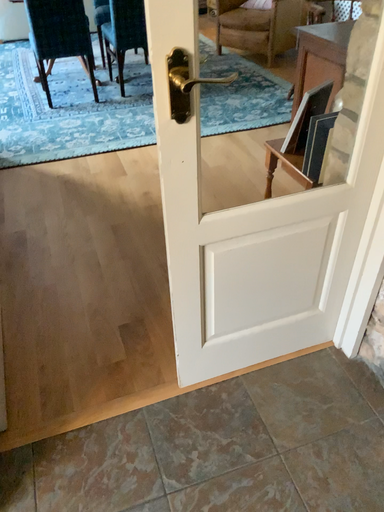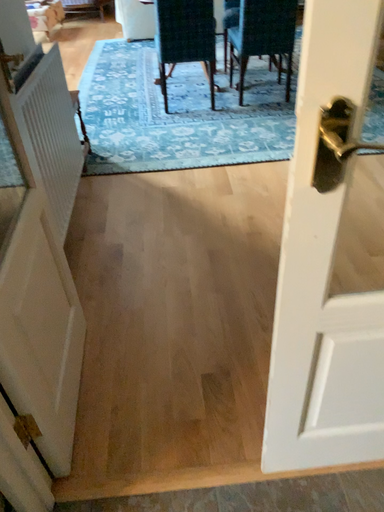
Question: Which way did the camera rotate in the video?

Choices:
 (A) rotated right
 (B) rotated left

Answer: (B)